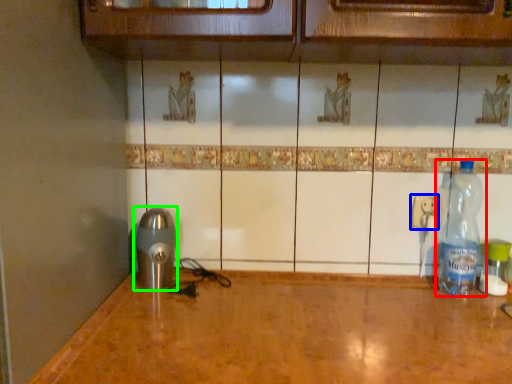
Question: Considering the real-world distances, which object is farthest from bottle (highlighted by a red box)? electric outlet (highlighted by a blue box) or appliance (highlighted by a green box)?

Choices:
 (A) electric outlet
 (B) appliance

Answer: (B)